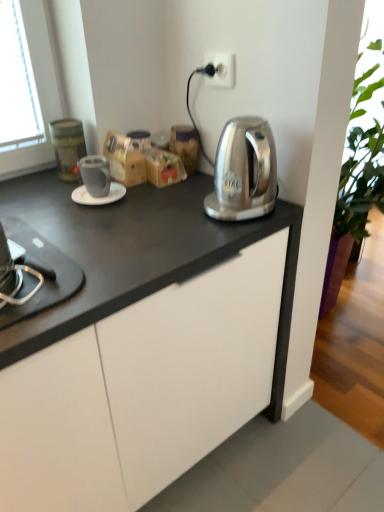
Find the location of a particular element. vacant location behind black glass stovetop at lower left is located at coordinates (58, 232).